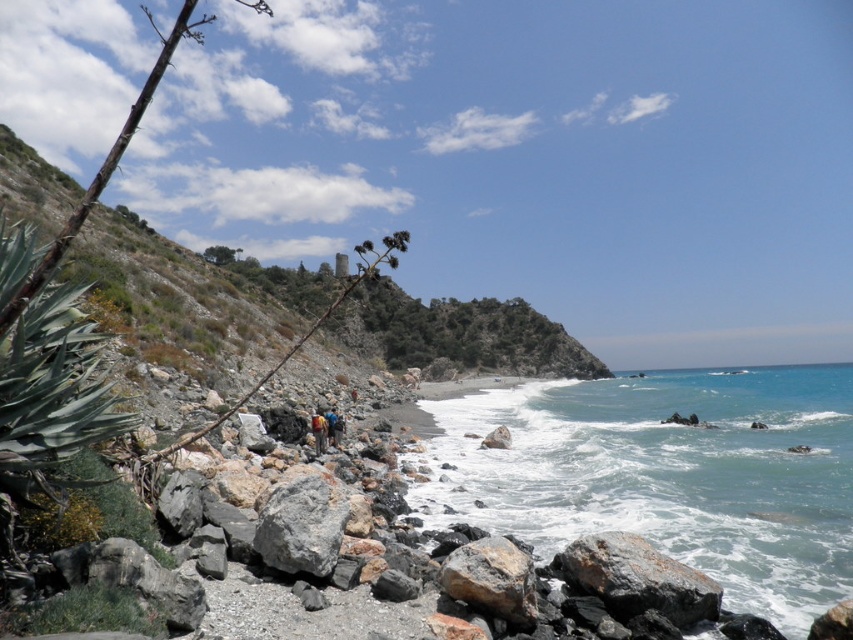
Question: Can you confirm if camouflage fabric person at center is bigger than blue fabric backpack at center?

Choices:
 (A) no
 (B) yes

Answer: (B)

Question: Which of the following is the farthest from the observer?

Choices:
 (A) (474, 563)
 (B) (675, 595)
 (C) (337, 420)

Answer: (C)

Question: Does gray rough rock at lower center have a lesser width compared to blue fabric backpack at center?

Choices:
 (A) yes
 (B) no

Answer: (B)

Question: Considering the relative positions of blue water at lower right and gray rough rock at lower center in the image provided, where is blue water at lower right located with respect to gray rough rock at lower center?

Choices:
 (A) below
 (B) above

Answer: (A)

Question: Among these points, which one is nearest to the camera?

Choices:
 (A) (714, 588)
 (B) (335, 419)
 (C) (316, 417)

Answer: (A)

Question: Among these objects, which one is nearest to the camera?

Choices:
 (A) rusty metallic rock at center
 (B) blue water at lower right
 (C) blue fabric backpack at center
 (D) gray rough rock at center

Answer: (A)